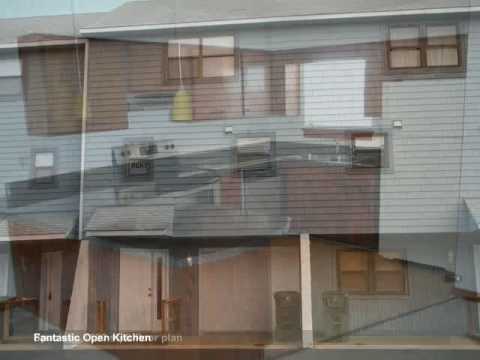
This screenshot has width=480, height=360. Find the location of `window in kitchen`. window in kitchen is located at coordinates (329, 97), (321, 71).